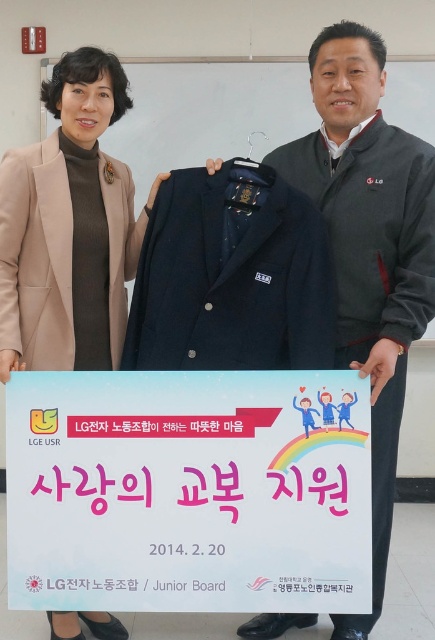
Question: Can you confirm if white paper sign at center is smaller than beige woolen coat at upper left?

Choices:
 (A) no
 (B) yes

Answer: (B)

Question: Is the position of white paper sign at center less distant than that of beige woolen coat at upper left?

Choices:
 (A) yes
 (B) no

Answer: (A)

Question: Among these points, which one is farthest from the camera?

Choices:
 (A) (90, 332)
 (B) (87, 422)

Answer: (A)

Question: Which object is farther from the camera taking this photo?

Choices:
 (A) beige woolen coat at upper left
 (B) white paper sign at center

Answer: (A)

Question: Does white paper sign at center lie in front of beige woolen coat at upper left?

Choices:
 (A) yes
 (B) no

Answer: (A)